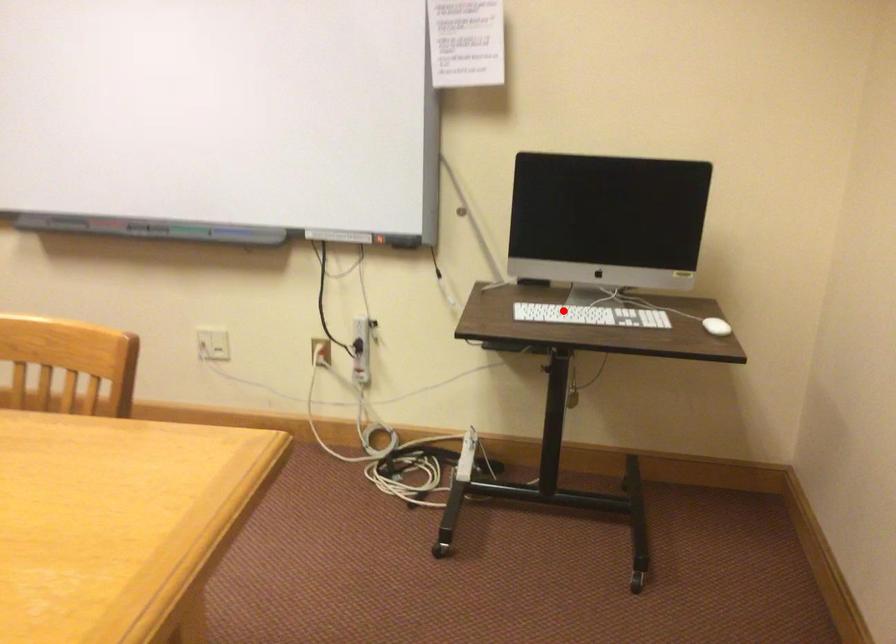
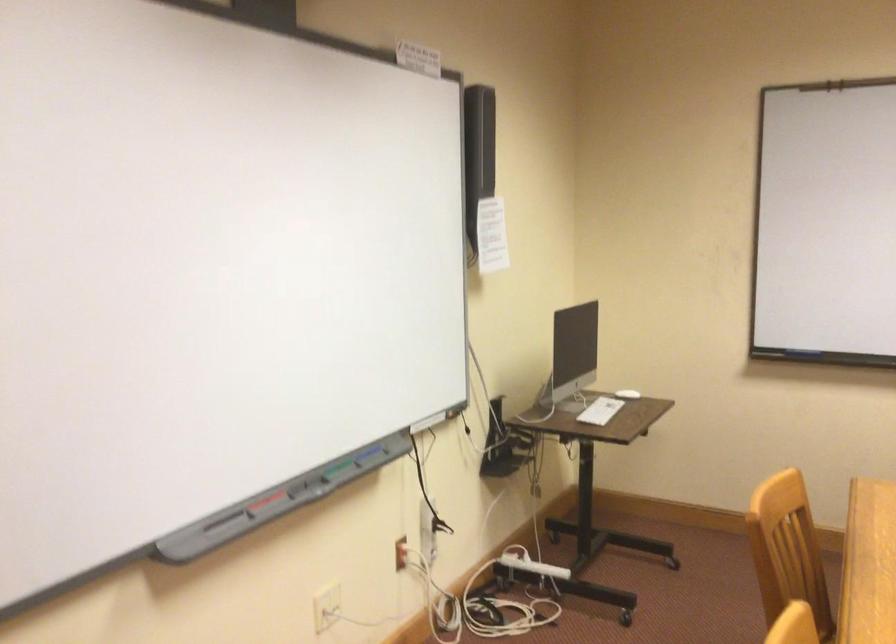
Question: I am providing you with two images of the same scene from different viewpoints. Image1 has a red point marked. In image2, the corresponding 3D location appears at what relative position? Reply with the corresponding letter.

Choices:
 (A) Closer
 (B) Farther

Answer: (B)